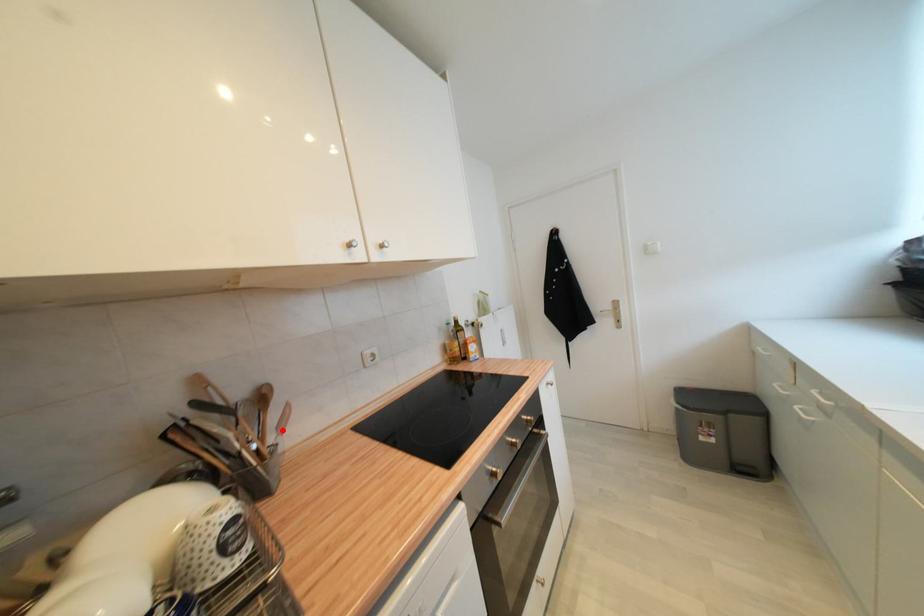
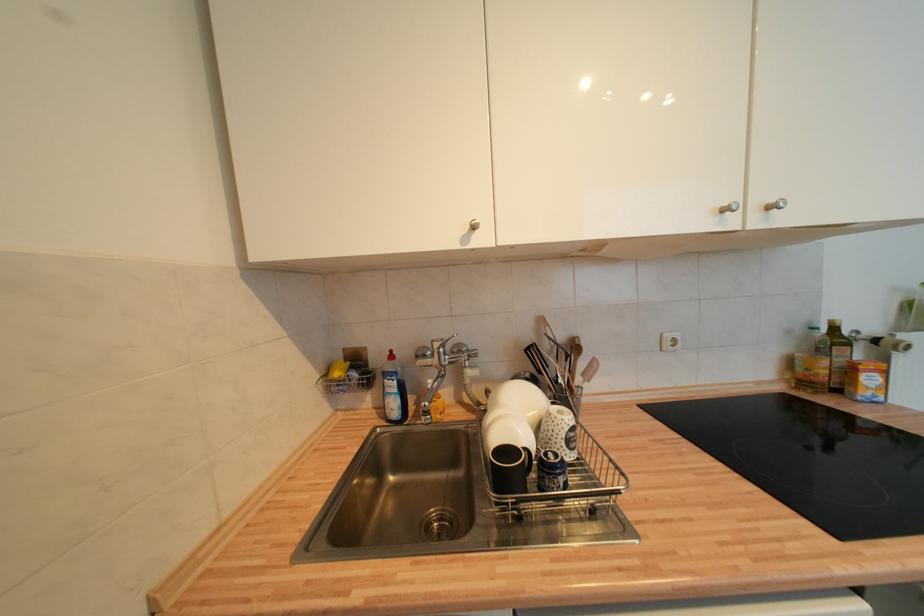
Locate, in the second image, the point that corresponds to the highlighted location in the first image.

(588, 377)